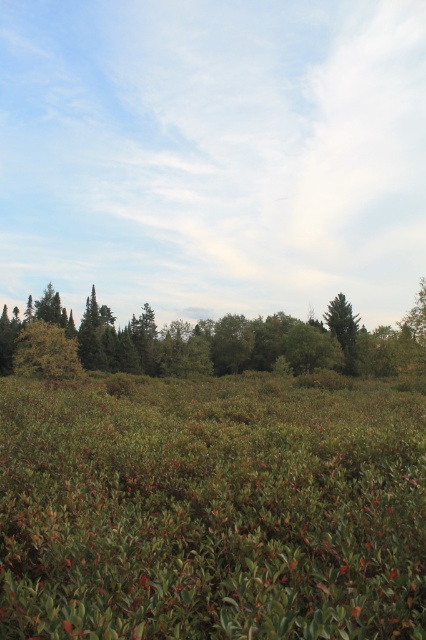
You are standing in the middle of the landscape and want to take a photo of both the green matte grass at center and the green matte tree at center. Which object will appear larger in the photo?

The green matte grass at center will appear larger in the photo because it is closer to the viewer than the green matte tree at center.

You are standing at the center of the landscape. Which direction should you walk to reach the green matte grass at center?

The green matte grass at center is located at point coordinates (210, 508), which is slightly to the right and forward from the center. Therefore, you should walk forward and slightly to the right to reach it.